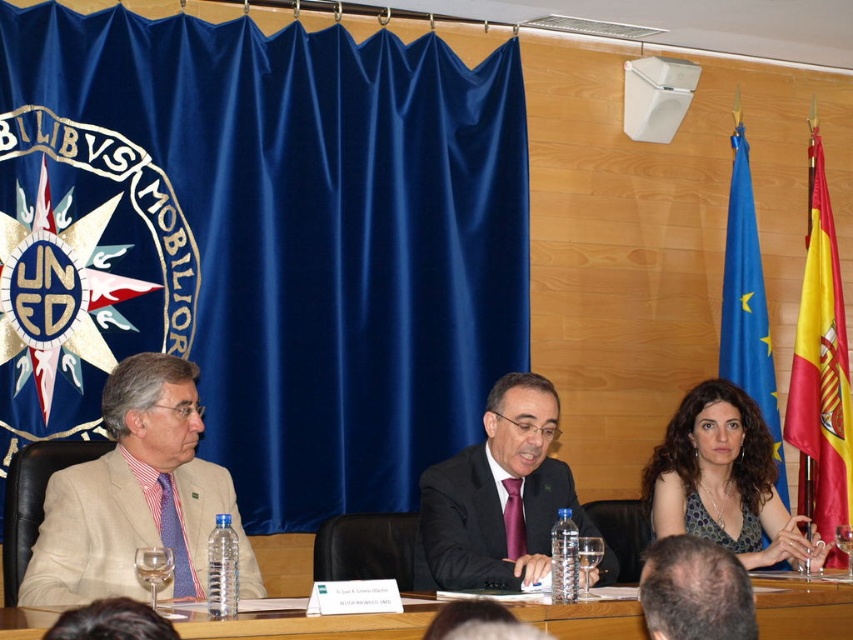
You are standing in front of the conference table and need to locate the dark suit at center. Can you tell me its coordinates in the image?

The dark suit at center is located at coordinates point [497,496].

You are standing in front of the conference table and want to place a small plant between the two points marked as point (424, 474) and point (732, 369). Which point should the plant be closer to in order to be nearer to the camera?

The plant should be placed closer to point (424, 474) because it is closer to the camera than point (732, 369).